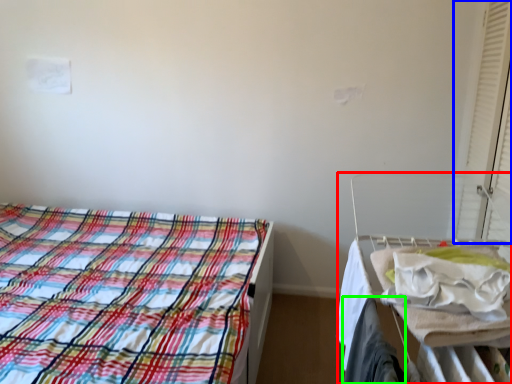
Question: Which is nearer to the hospital bed (highlighted by a red box)? curtain (highlighted by a blue box) or clothing (highlighted by a green box).

Choices:
 (A) curtain
 (B) clothing

Answer: (B)